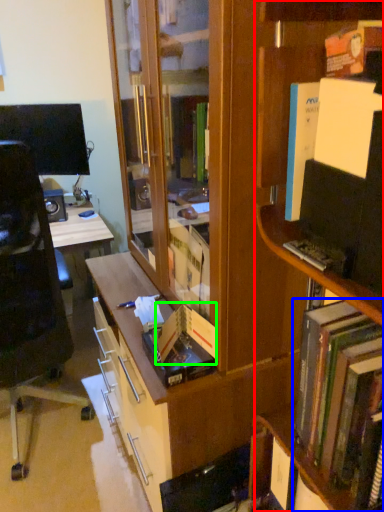
Question: Which is farther away from shelf (highlighted by a red box)? book (highlighted by a blue box) or paperback book (highlighted by a green box)?

Choices:
 (A) book
 (B) paperback book

Answer: (B)